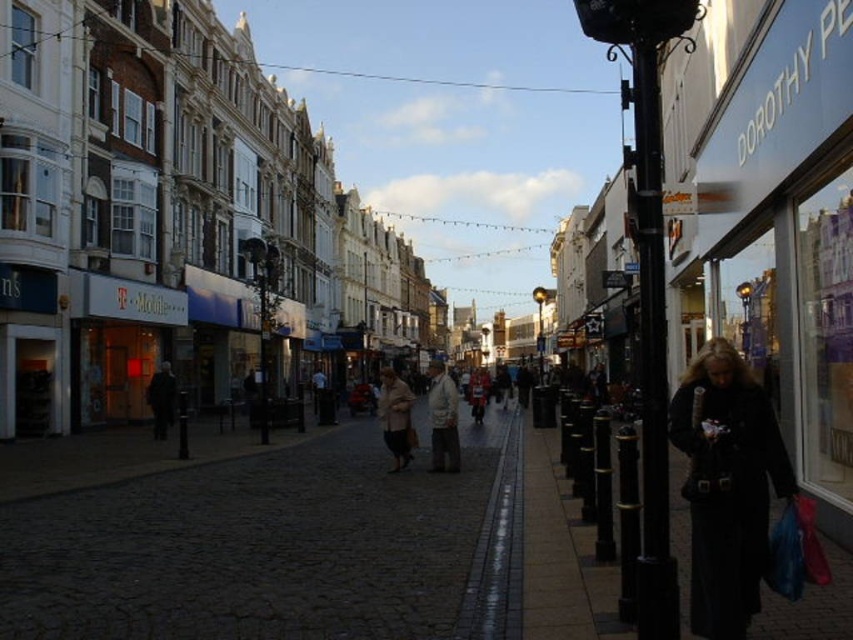
Does white textured coat at center appear over light beige coat at center?

Incorrect, white textured coat at center is not positioned above light beige coat at center.

Which is in front, point (437, 428) or point (396, 458)?

Positioned in front is point (437, 428).

I want to click on white textured coat at center, so click(442, 419).

I want to click on white textured coat at center, so click(x=442, y=419).

Who is more distant from viewer, [488,451] or [740,444]?

Positioned behind is point [488,451].

Is dark cobblestone pavement at center to the right of black leather coat at lower right from the viewer's perspective?

In fact, dark cobblestone pavement at center is to the left of black leather coat at lower right.

What are the coordinates of `dark cobblestone pavement at center` in the screenshot? It's located at (271, 548).

The image size is (853, 640). Identify the location of black leather coat at lower right. (727, 486).

Can you confirm if black leather coat at lower right is wider than light beige coat at center?

Incorrect, black leather coat at lower right's width does not surpass light beige coat at center's.

Where is `black leather coat at lower right`? black leather coat at lower right is located at coordinates [x=727, y=486].

What are the coordinates of `black leather coat at lower right` in the screenshot? It's located at (727, 486).